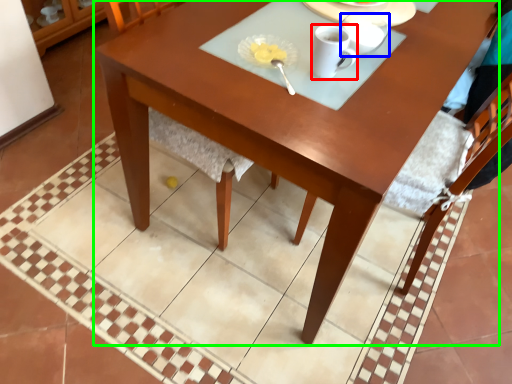
Question: Based on their relative distances, which object is farther from coffee cup (highlighted by a red box)? Choose from tableware (highlighted by a blue box) and desk (highlighted by a green box).

Choices:
 (A) tableware
 (B) desk

Answer: (B)